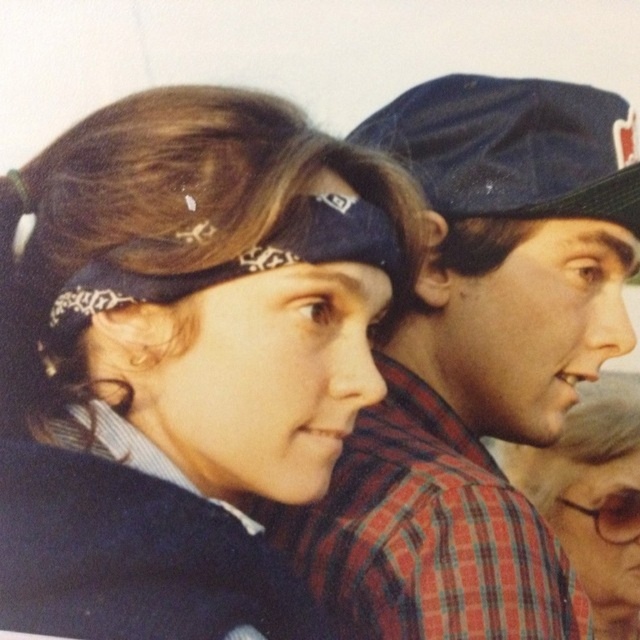
Question: Is matte black bandana at center further to the viewer compared to plaid fabric shirt at center?

Choices:
 (A) yes
 (B) no

Answer: (B)

Question: Among these points, which one is farthest from the camera?

Choices:
 (A) (100, 499)
 (B) (538, 204)
 (C) (552, 580)

Answer: (B)

Question: Can you confirm if matte black bandana at center is positioned to the right of matte black headband at upper center?

Choices:
 (A) no
 (B) yes

Answer: (A)

Question: Is matte black bandana at center further to the viewer compared to matte black headband at upper center?

Choices:
 (A) yes
 (B) no

Answer: (B)

Question: Which point is farther to the camera?

Choices:
 (A) (596, 403)
 (B) (429, 144)
 (C) (202, 522)
 (D) (524, 132)

Answer: (A)

Question: Which of the following is the farthest from the observer?

Choices:
 (A) matte black bandana at center
 (B) blue fabric baseball cap at upper right
 (C) matte black headband at upper center
 (D) plaid fabric shirt at center

Answer: (C)